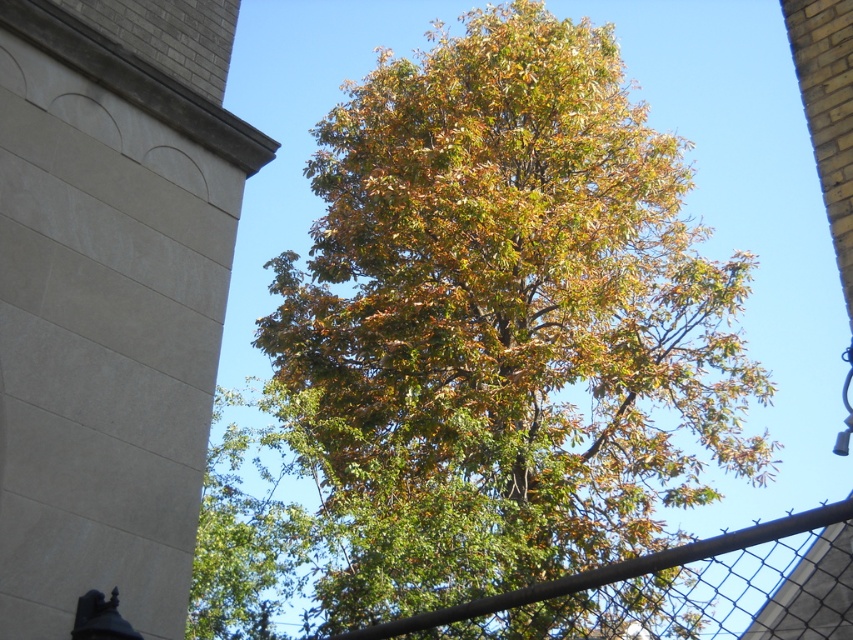
Which of these two, beige stone tower at upper left or rustic metal fence at center, stands taller?

With more height is beige stone tower at upper left.

Is beige stone tower at upper left below rustic metal fence at center?

Actually, beige stone tower at upper left is above rustic metal fence at center.

Is point (32, 81) behind point (579, 589)?

That is True.

You are a GUI agent. You are given a task and a screenshot of the screen. Output one action in this format:
    pyautogui.click(x=<x>, y=<y>)
    Task: Click on the beige stone tower at upper left
    This screenshot has width=853, height=640.
    Given the screenshot: What is the action you would take?
    pyautogui.click(x=109, y=296)

Is green leafy tree at center to the right of beige stone tower at upper left from the viewer's perspective?

Yes, green leafy tree at center is to the right of beige stone tower at upper left.

Is green leafy tree at center thinner than beige stone tower at upper left?

No.

Who is more distant from viewer, (453, 420) or (183, 51)?

The point (453, 420) is more distant.

Find the location of a particular element. The image size is (853, 640). green leafy tree at center is located at coordinates (500, 324).

Who is higher up, green leafy tree at center or rustic metal fence at center?

green leafy tree at center is higher up.

Where is `green leafy tree at center`? The image size is (853, 640). green leafy tree at center is located at coordinates click(x=500, y=324).

I want to click on green leafy tree at center, so click(x=500, y=324).